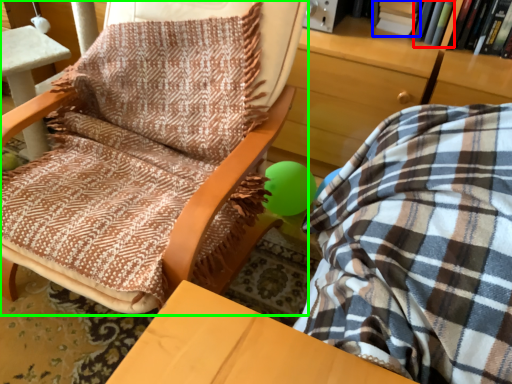
Question: Considering the real-world distances, which object is farthest from book (highlighted by a red box)? book (highlighted by a blue box) or chair (highlighted by a green box)?

Choices:
 (A) book
 (B) chair

Answer: (B)